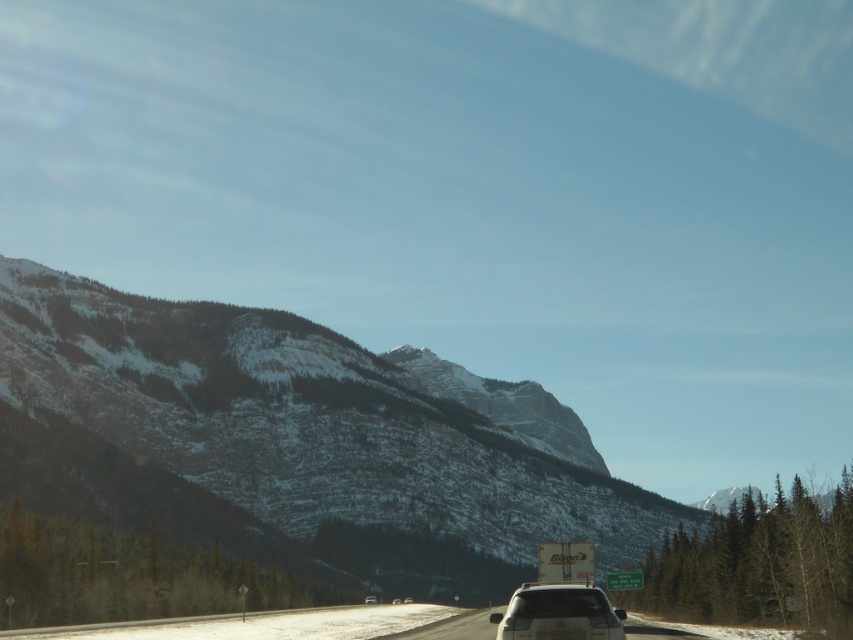
Question: Does snowy rock mountain at center lie in front of white matte car at center?

Choices:
 (A) no
 (B) yes

Answer: (A)

Question: Which point is closer to the camera taking this photo?

Choices:
 (A) (592, 586)
 (B) (407, 474)

Answer: (A)

Question: Which point appears farthest from the camera in this image?

Choices:
 (A) (585, 616)
 (B) (477, 436)

Answer: (B)

Question: Can you confirm if snowy rock mountain at center is positioned to the right of white matte car at center?

Choices:
 (A) yes
 (B) no

Answer: (B)

Question: Can you confirm if snowy rock mountain at center is positioned below white matte car at center?

Choices:
 (A) no
 (B) yes

Answer: (B)